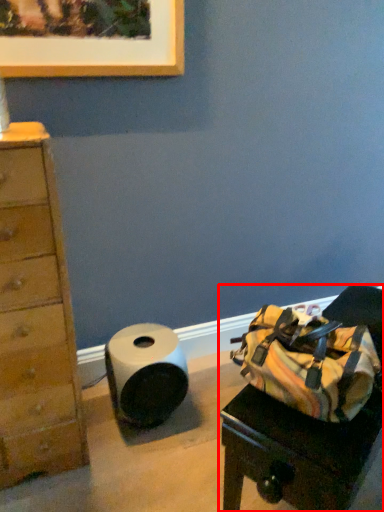
Question: From the image's perspective, where is furniture (annotated by the red box) located relative to paper towel?

Choices:
 (A) below
 (B) above

Answer: (A)